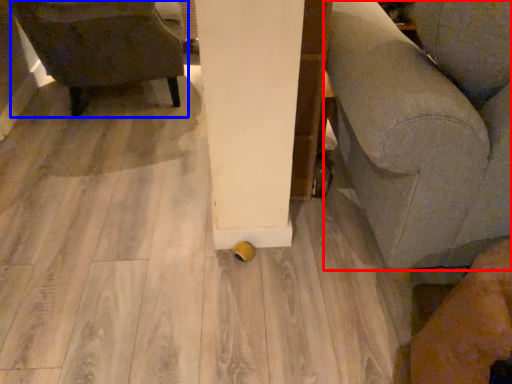
Question: Among these objects, which one is nearest to the camera, furniture (highlighted by a red box) or chair (highlighted by a blue box)?

Choices:
 (A) furniture
 (B) chair

Answer: (A)